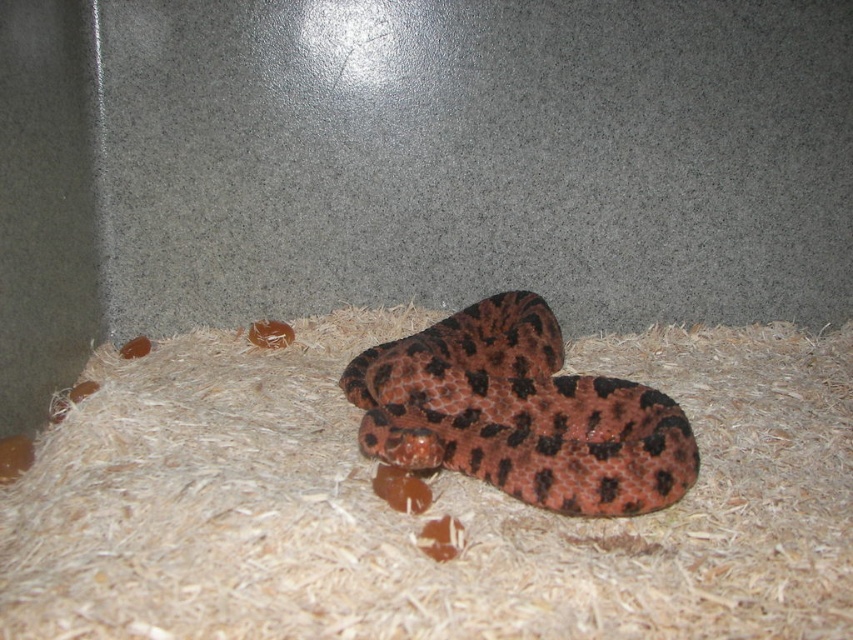
You are an animal caretaker who needs to clean the enclosure. You see the brown shredded hay at center and the leopard print snake at center. Where should you start cleaning first to avoid disturbing the snake?

The brown shredded hay at center is located below the leopard print snake at center, so you should start cleaning the brown shredded hay at center first as it is underneath the snake and less likely to disturb it.

You are a small animal trying to reach the brown shredded hay at center from your current position near the enclosure wall. The enclosure is 3.5 feet wide. Can you safely cross the enclosure to reach the hay without exceeding the enclosure width?

The distance between the brown shredded hay at center and the viewer is 3.49 feet, which is slightly less than the enclosure width of 3.5 feet. Therefore, you can safely cross the enclosure to reach the brown shredded hay at center without exceeding the enclosure width.

You are a zookeeper preparing to feed the snake in the enclosure. The snake is coiled at the center marked by point (x=432, y=504). To avoid startling it, you need to approach from a direction where there are no wood shavings. Are there any areas around the snake where you can approach without stepping on the brown shredded hay at center?

The brown shredded hay at center is located at point (x=432, y=504), which is exactly where the snake is coiled. Therefore, there are no areas around the snake where you can approach without stepping on the brown shredded hay at center since the hay covers the entire surface of the enclosure.